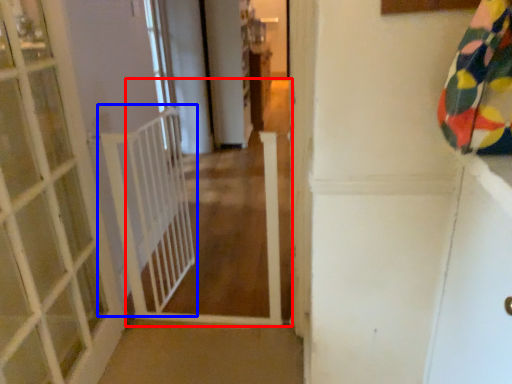
Question: Among these objects, which one is nearest to the camera, path (highlighted by a red box) or balustrade (highlighted by a blue box)?

Choices:
 (A) path
 (B) balustrade

Answer: (A)